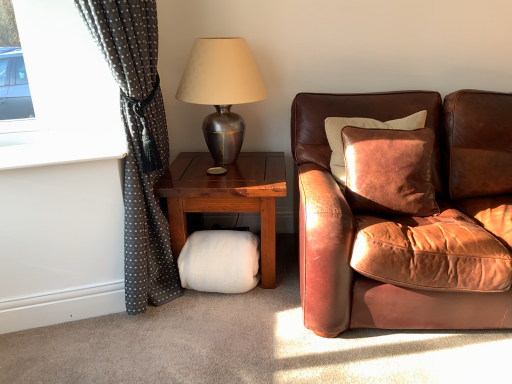
Question: Visually, is white fluffy pillow at lower center positioned to the left or to the right of metallic silver lamp at upper center?

Choices:
 (A) right
 (B) left

Answer: (A)

Question: Is white fluffy pillow at lower center bigger or smaller than metallic silver lamp at upper center?

Choices:
 (A) big
 (B) small

Answer: (A)

Question: Considering the real-world distances, which object is farthest from the brown leather couch at right?

Choices:
 (A) dark grey polka dot fabric at left
 (B) leather cushion at right
 (C) white fluffy footrest at lower center
 (D) white fluffy pillow at lower center
 (E) metallic silver lamp at upper center

Answer: (A)

Question: Which is farther from the brown leather couch at right?

Choices:
 (A) white fluffy footrest at lower center
 (B) metallic silver lamp at upper center
 (C) dark grey polka dot fabric at left
 (D) white fluffy pillow at lower center
 (E) leather cushion at right

Answer: (C)